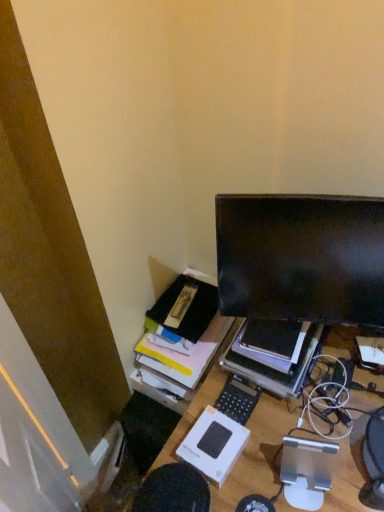
Question: Considering the relative sizes of matte black monitor at upper right and black plastic calculator at center in the image provided, is matte black monitor at upper right taller than black plastic calculator at center?

Choices:
 (A) yes
 (B) no

Answer: (A)

Question: Is black plastic calculator at center surrounded by matte black monitor at upper right?

Choices:
 (A) no
 (B) yes

Answer: (A)

Question: From a real-world perspective, is matte black monitor at upper right on black plastic calculator at center?

Choices:
 (A) yes
 (B) no

Answer: (A)

Question: From the image's perspective, is matte black monitor at upper right located above black plastic calculator at center?

Choices:
 (A) yes
 (B) no

Answer: (A)

Question: Is the depth of matte black monitor at upper right less than that of black plastic calculator at center?

Choices:
 (A) yes
 (B) no

Answer: (A)

Question: Based on their positions, is black plastic calculator at center located to the left or right of wooden desk at center?

Choices:
 (A) right
 (B) left

Answer: (B)

Question: From the image's perspective, is black plastic calculator at center above or below wooden desk at center?

Choices:
 (A) above
 (B) below

Answer: (A)

Question: Is point (228, 411) closer or farther from the camera than point (349, 474)?

Choices:
 (A) closer
 (B) farther

Answer: (B)

Question: Is black plastic calculator at center situated inside wooden desk at center or outside?

Choices:
 (A) outside
 (B) inside

Answer: (A)

Question: Considering the positions of wooden desk at center and black plastic calculator at center in the image, is wooden desk at center bigger or smaller than black plastic calculator at center?

Choices:
 (A) small
 (B) big

Answer: (B)

Question: In the image, is wooden desk at center positioned in front of or behind black plastic calculator at center?

Choices:
 (A) front
 (B) behind

Answer: (A)

Question: Choose the correct answer: Is wooden desk at center inside black plastic calculator at center or outside it?

Choices:
 (A) outside
 (B) inside

Answer: (A)

Question: From a real-world perspective, is wooden desk at center positioned above or below black plastic calculator at center?

Choices:
 (A) above
 (B) below

Answer: (B)

Question: From a real-world perspective, is black plastic calculator at center positioned above or below black matte monitor at upper right?

Choices:
 (A) above
 (B) below

Answer: (B)

Question: From the image's perspective, is black plastic calculator at center above or below black matte monitor at upper right?

Choices:
 (A) above
 (B) below

Answer: (B)